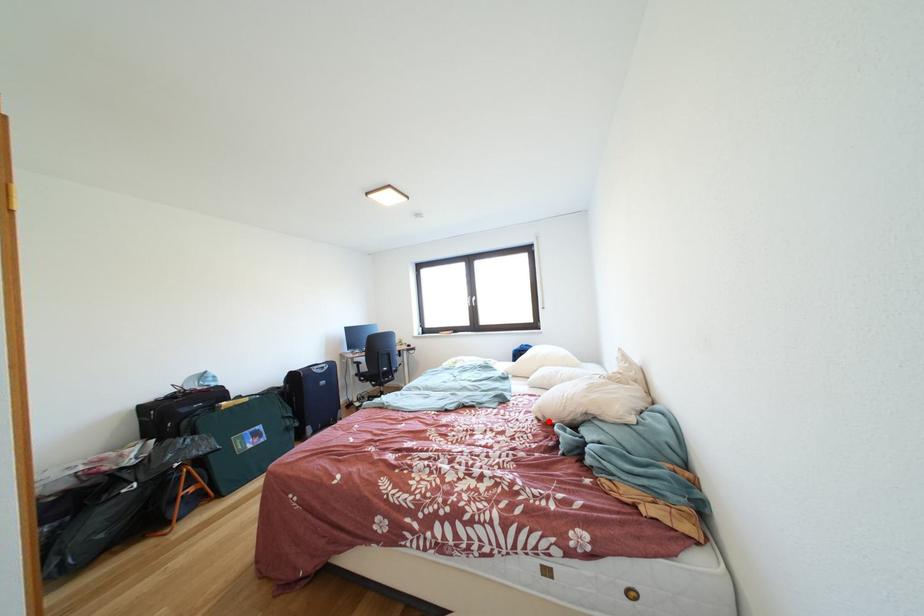
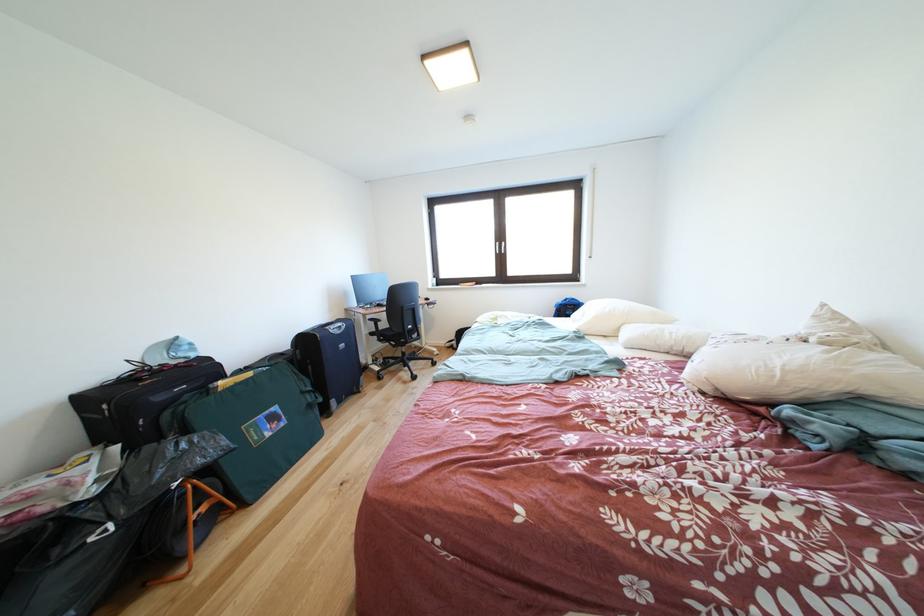
Where in the second image is the point corresponding to the highlighted location from the first image?

(716, 394)